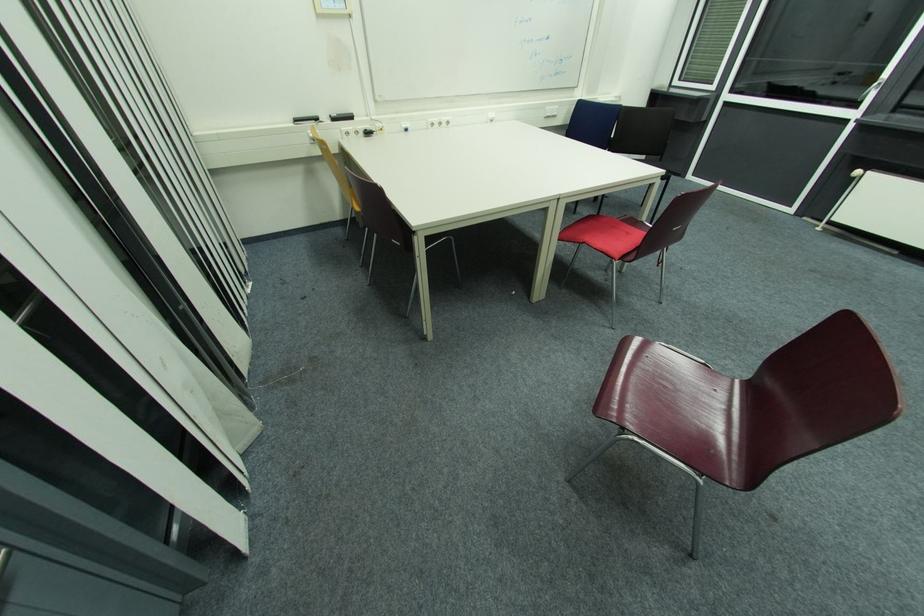
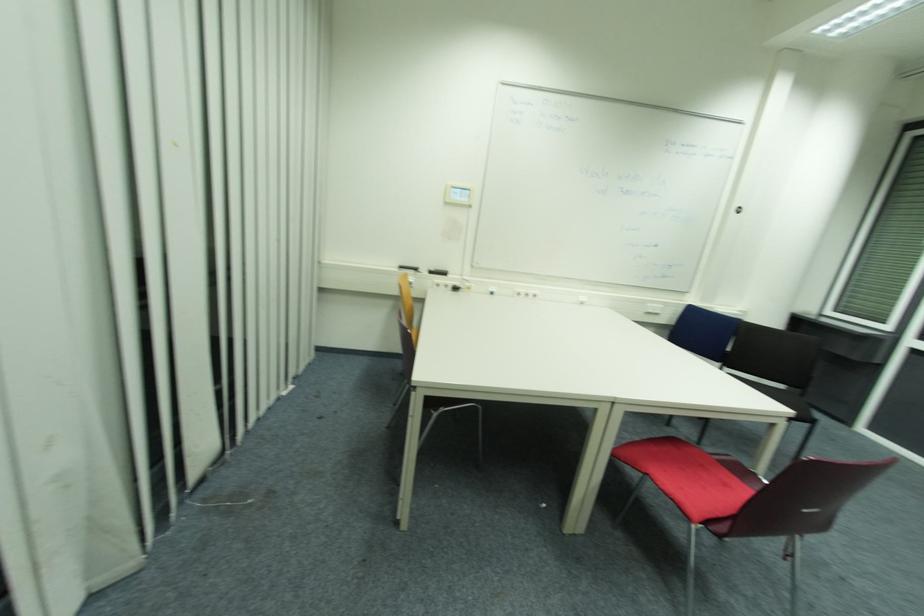
Where in the second image is the point corresponding to [444,124] from the first image?

(529, 294)